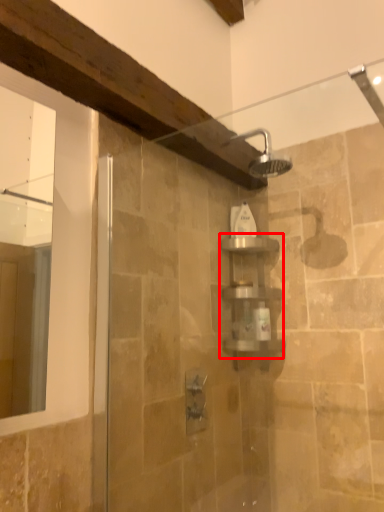
Question: From the image's perspective, what is the correct spatial relationship of shelf (annotated by the red box) in relation to toiletry?

Choices:
 (A) below
 (B) above

Answer: (A)